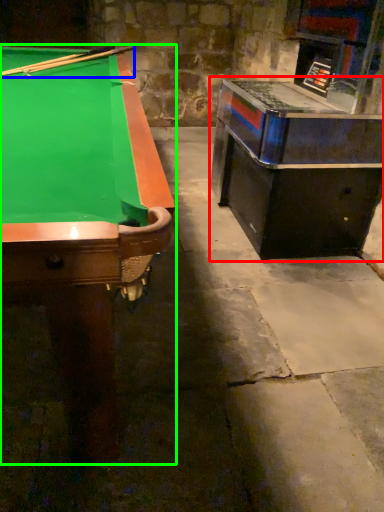
Question: Which object is positioned closest to table (highlighted by a red box)? Select from cue (highlighted by a blue box) and billiard table (highlighted by a green box).

Choices:
 (A) cue
 (B) billiard table

Answer: (B)